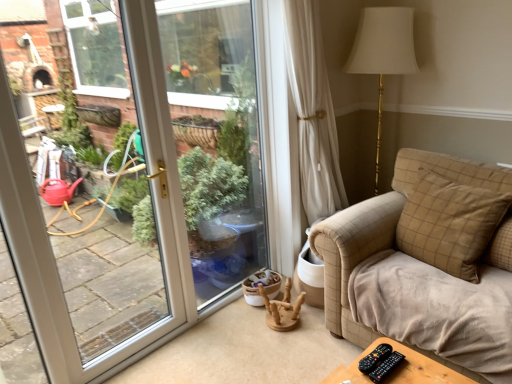
Question: From the image's perspective, is black plastic remote at lower right, which is counted as the second remote, starting from the right, below beige checkered pillow at right, the 1th pillow viewed from the front?

Choices:
 (A) yes
 (B) no

Answer: (A)

Question: Could beige checkered pillow at right, placed as the second pillow when sorted from back to front, be considered to be inside black plastic remote at lower right, which ranks as the first remote in left-to-right order?

Choices:
 (A) no
 (B) yes

Answer: (A)

Question: Is black plastic remote at lower right, which is counted as the second remote, starting from the right, closer to the viewer compared to beige checkered pillow at right, placed as the second pillow when sorted from back to front?

Choices:
 (A) yes
 (B) no

Answer: (A)

Question: Is black plastic remote at lower right, which ranks as the first remote in left-to-right order, taller than beige checkered pillow at right, the 1th pillow viewed from the front?

Choices:
 (A) no
 (B) yes

Answer: (A)

Question: Is beige checkered pillow at right, the 1th pillow viewed from the front, at the back of black plastic remote at lower right, which is counted as the second remote, starting from the right?

Choices:
 (A) yes
 (B) no

Answer: (A)

Question: Considering their positions, is beige checkered pillow at right, placed as the 2th pillow when sorted from front to back, located in front of or behind black plastic remote at lower right, which is counted as the second remote, starting from the right?

Choices:
 (A) front
 (B) behind

Answer: (B)

Question: Considering the positions of point (508, 231) and point (382, 355), is point (508, 231) closer or farther from the camera than point (382, 355)?

Choices:
 (A) farther
 (B) closer

Answer: (A)

Question: Is beige checkered pillow at right, placed as the 2th pillow when sorted from front to back, inside or outside of black plastic remote at lower right, which is counted as the second remote, starting from the right?

Choices:
 (A) inside
 (B) outside

Answer: (B)

Question: From a real-world perspective, is beige checkered pillow at right, which is counted as the first pillow, starting from the back, above or below black plastic remote at lower right, which ranks as the first remote in left-to-right order?

Choices:
 (A) above
 (B) below

Answer: (A)

Question: From the image's perspective, is wooden at center above or below beige checkered pillow at right, which is counted as the first pillow, starting from the back?

Choices:
 (A) above
 (B) below

Answer: (B)

Question: Considering the positions of point (289, 309) and point (510, 256), is point (289, 309) closer or farther from the camera than point (510, 256)?

Choices:
 (A) farther
 (B) closer

Answer: (A)

Question: Considering their positions, is wooden at center located in front of or behind beige checkered pillow at right, which is counted as the first pillow, starting from the back?

Choices:
 (A) front
 (B) behind

Answer: (B)

Question: Considering the positions of wooden at center and beige checkered pillow at right, placed as the 2th pillow when sorted from front to back, in the image, is wooden at center wider or thinner than beige checkered pillow at right, placed as the 2th pillow when sorted from front to back,?

Choices:
 (A) thin
 (B) wide

Answer: (B)

Question: Do you think black plastic remote at lower right, the 2th remote in the left-to-right sequence, is within beige checkered pillow at right, placed as the second pillow when sorted from back to front, or outside of it?

Choices:
 (A) inside
 (B) outside

Answer: (B)

Question: Does point (381, 370) appear closer or farther from the camera than point (408, 198)?

Choices:
 (A) closer
 (B) farther

Answer: (A)